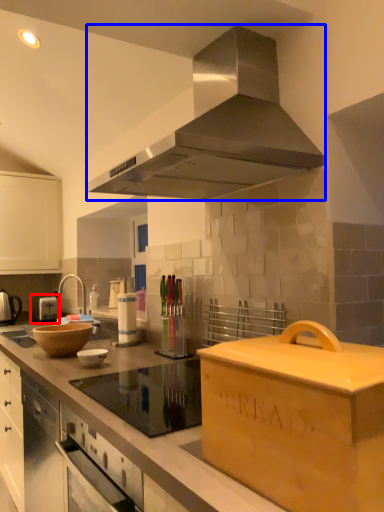
Question: Among these objects, which one is nearest to the camera, appliance (highlighted by a red box) or home appliance (highlighted by a blue box)?

Choices:
 (A) appliance
 (B) home appliance

Answer: (B)